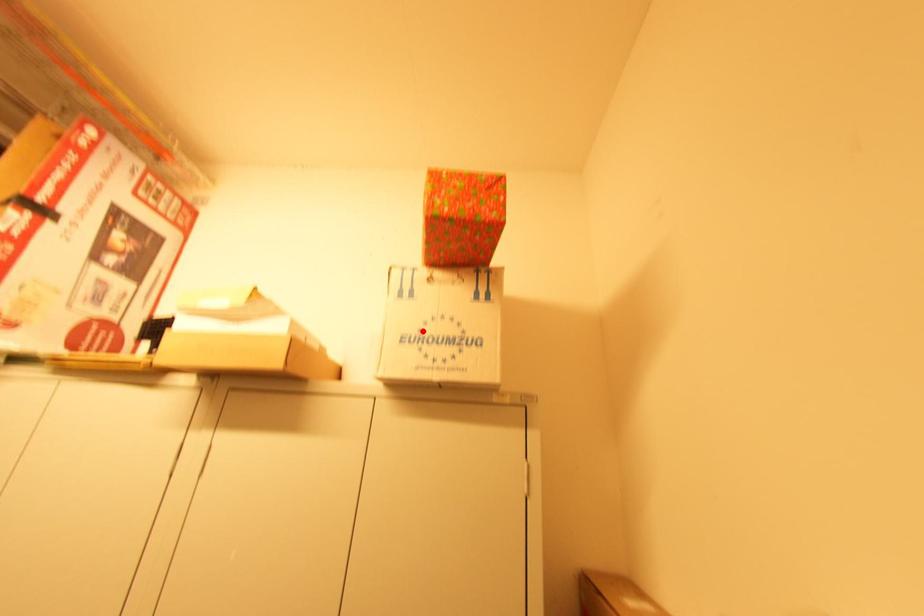
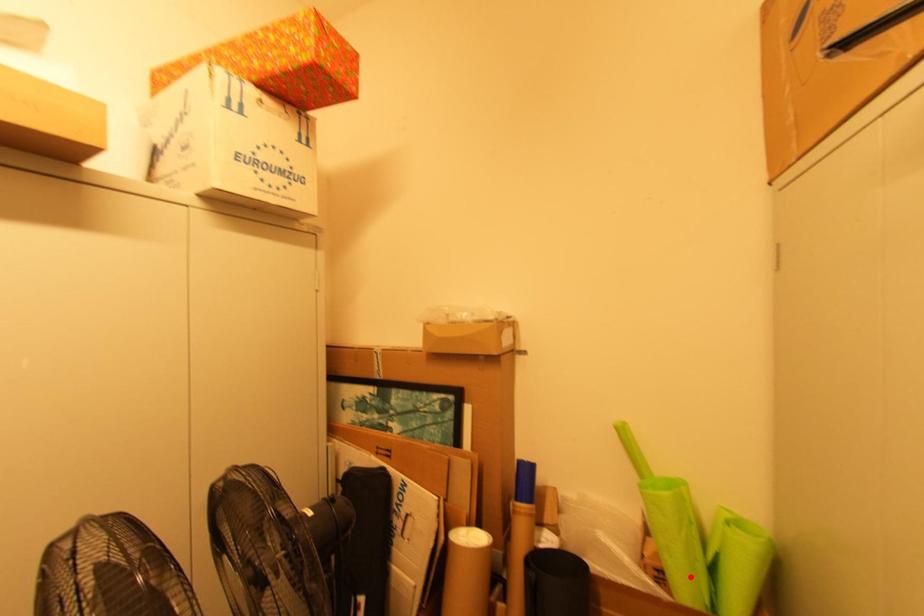
I am providing you with two images of the same scene from different viewpoints. A red point is marked on the first image and another point is marked on the second image. Is the marked point in image1 the same physical position as the marked point in image2?

No